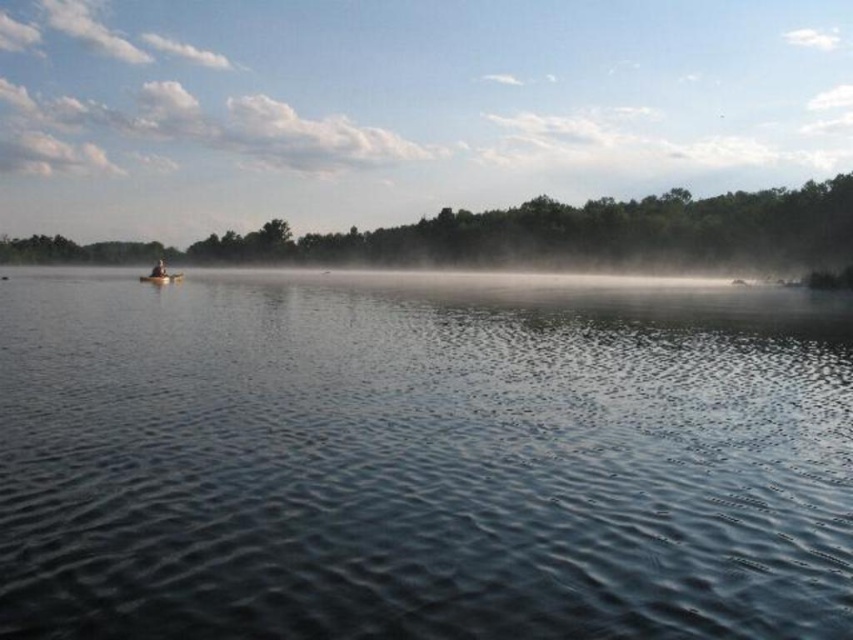
Question: Can you confirm if smooth dark water at center is bigger than brown wooden boat at left?

Choices:
 (A) yes
 (B) no

Answer: (A)

Question: Which object appears farthest from the camera in this image?

Choices:
 (A) smooth wooden canoe at left
 (B) black plastic paddle at left

Answer: (A)

Question: Does smooth wooden canoe at left come behind black plastic paddle at left?

Choices:
 (A) yes
 (B) no

Answer: (A)

Question: Which object is closer to the camera taking this photo?

Choices:
 (A) smooth wooden canoe at left
 (B) brown wooden boat at left

Answer: (B)

Question: Estimate the real-world distances between objects in this image. Which object is closer to the smooth dark water at center?

Choices:
 (A) black plastic paddle at left
 (B) wooden canoe at center
 (C) brown wooden boat at left
 (D) smooth wooden canoe at left

Answer: (B)

Question: Is smooth dark water at center below smooth wooden canoe at left?

Choices:
 (A) no
 (B) yes

Answer: (B)